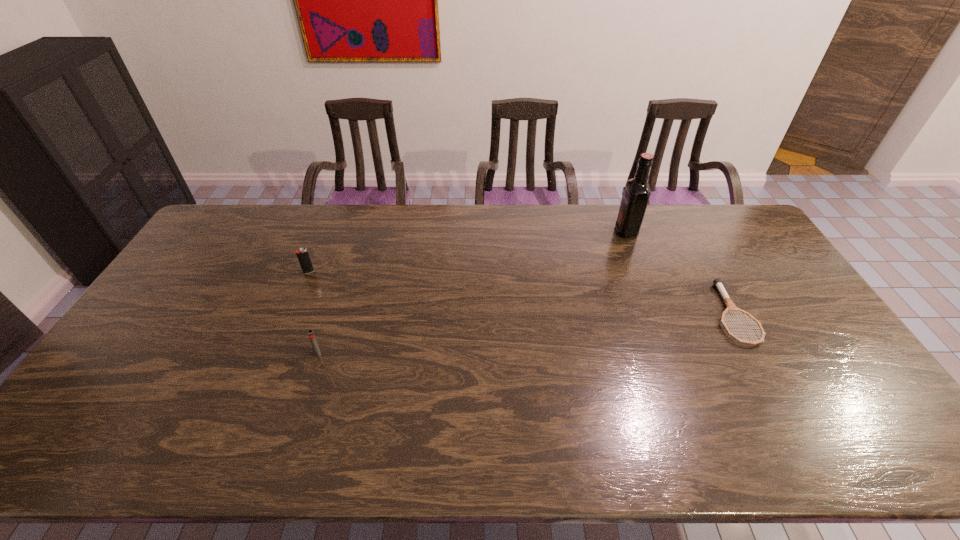
Locate an element on the screen. the third object from left to right is located at coordinates (637, 192).

At what (x,y) coordinates should I click in order to perform the action: click on liquor. Please return your answer as a coordinate pair (x, y). Looking at the image, I should click on (637, 192).

The image size is (960, 540). I want to click on the left igniter, so click(302, 254).

Locate an element on the screen. The width and height of the screenshot is (960, 540). the leftmost object is located at coordinates (302, 254).

This screenshot has height=540, width=960. I want to click on the second object from left to right, so click(x=311, y=335).

This screenshot has width=960, height=540. I want to click on the nearest object, so (311, 335).

At what (x,y) coordinates should I click in order to perform the action: click on the rightmost object. Please return your answer as a coordinate pair (x, y). This screenshot has height=540, width=960. Looking at the image, I should click on (731, 307).

You are a GUI agent. You are given a task and a screenshot of the screen. Output one action in this format:
    pyautogui.click(x=<x>, y=<y>)
    Task: Click on the second nearest object
    
    Given the screenshot: What is the action you would take?
    pyautogui.click(x=731, y=307)

Locate an element on the screen. The height and width of the screenshot is (540, 960). free region located 0.080m on the front-facing side of the liquor is located at coordinates (593, 231).

Where is `vacant space located 0.080m on the front-facing side of the liquor`? The width and height of the screenshot is (960, 540). vacant space located 0.080m on the front-facing side of the liquor is located at coordinates (593, 231).